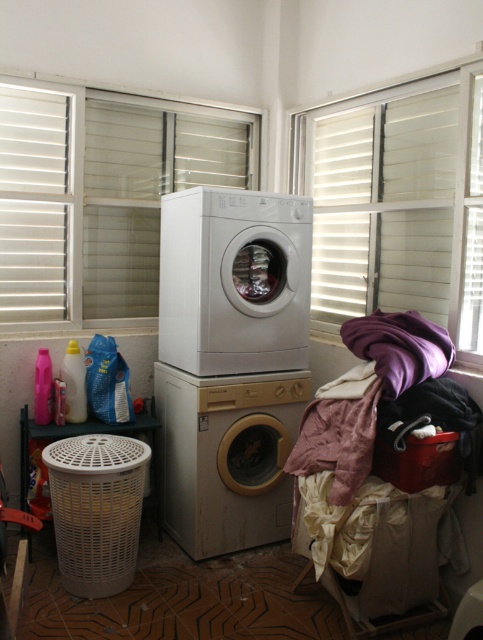
Question: Observing the image, what is the correct spatial positioning of white/textured blinds at upper right in reference to red plastic basket at lower right?

Choices:
 (A) above
 (B) below

Answer: (A)

Question: Can you confirm if white glossy washing machine at center is bigger than beige wood washing machine at center?

Choices:
 (A) no
 (B) yes

Answer: (B)

Question: Which object is the closest to the red plastic basket at lower right?

Choices:
 (A) beige wood washing machine at center
 (B) purple soft fabric at right

Answer: (B)

Question: Does white plastic laundry basket at lower left appear over purple soft fabric at right?

Choices:
 (A) no
 (B) yes

Answer: (A)

Question: Which of the following is the farthest from the observer?

Choices:
 (A) white/textured blinds at upper right
 (B) red plastic basket at lower right
 (C) beige wood washing machine at center

Answer: (C)

Question: Estimate the real-world distances between objects in this image. Which object is closer to the white plastic laundry basket at lower left?

Choices:
 (A) beige wood washing machine at center
 (B) white glossy washing machine at center

Answer: (A)